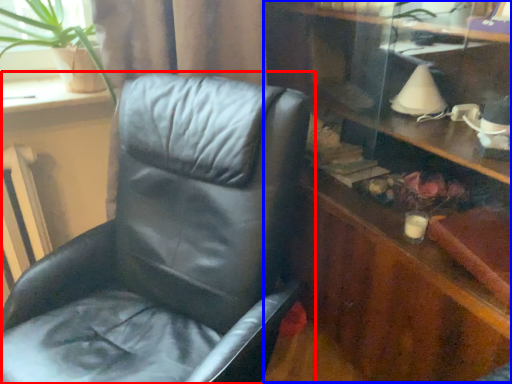
Question: Which object appears closest to the camera in this image, chair (highlighted by a red box) or dresser (highlighted by a blue box)?

Choices:
 (A) chair
 (B) dresser

Answer: (A)